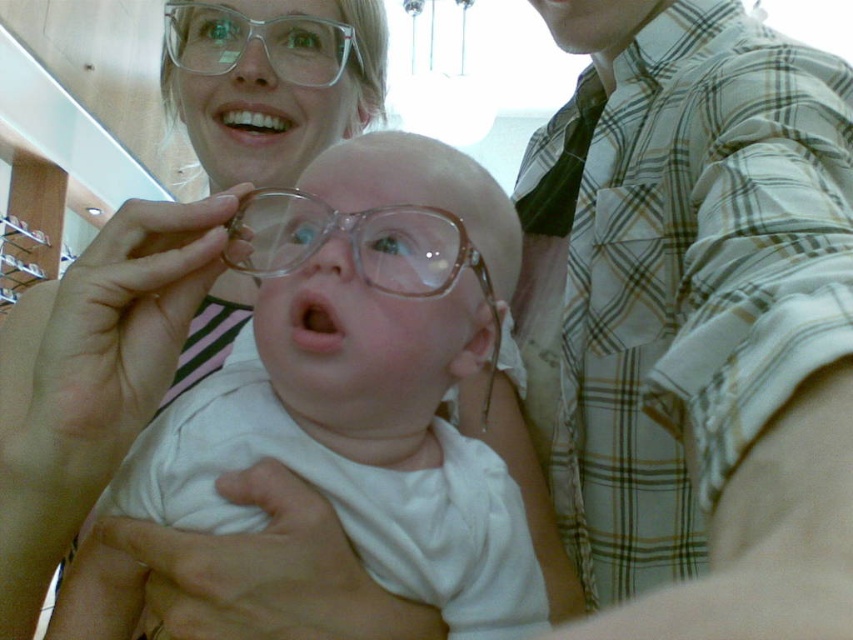
In the scene shown: Who is lower down, clear plastic glasses at center or clear plastic glasses at upper center?

clear plastic glasses at center is lower down.

Can you confirm if clear plastic glasses at center is thinner than clear plastic glasses at upper center?

In fact, clear plastic glasses at center might be wider than clear plastic glasses at upper center.

Is point (424, 472) positioned after point (231, 61)?

No, it is not.

In order to click on clear plastic glasses at center in this screenshot , I will do `click(351, 394)`.

Does transparent plastic glasses at center appear on the right side of clear plastic glasses at upper center?

Yes, transparent plastic glasses at center is to the right of clear plastic glasses at upper center.

Which of these two, transparent plastic glasses at center or clear plastic glasses at upper center, stands taller?

clear plastic glasses at upper center is taller.

Is point (286, 228) more distant than point (170, 35)?

No, (286, 228) is in front of (170, 35).

The height and width of the screenshot is (640, 853). Find the location of `transparent plastic glasses at center`. transparent plastic glasses at center is located at coordinates (354, 243).

Which of these two, clear plastic glasses at center or white glossy teeth at upper center, stands taller?

With more height is clear plastic glasses at center.

Is clear plastic glasses at center positioned behind white glossy teeth at upper center?

No, it is in front of white glossy teeth at upper center.

Which is in front, point (335, 500) or point (285, 124)?

Point (335, 500) is in front.

Image resolution: width=853 pixels, height=640 pixels. What are the coordinates of `clear plastic glasses at center` in the screenshot? It's located at (351, 394).